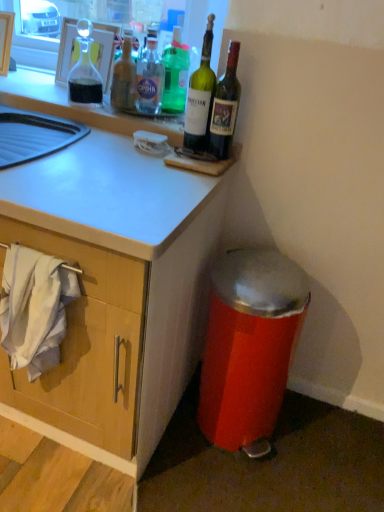
Question: Is translucent glass bottle at upper center, marked as the 1th bottle in a left-to-right arrangement, wider than green glass bottle at upper center, the 2th bottle positioned from the right?

Choices:
 (A) yes
 (B) no

Answer: (B)

Question: Is translucent glass bottle at upper center, acting as the fifth bottle starting from the right, next to green glass bottle at upper center, the 2th bottle positioned from the right, and touching it?

Choices:
 (A) no
 (B) yes

Answer: (A)

Question: Does translucent glass bottle at upper center, acting as the fifth bottle starting from the right, appear on the left side of green glass bottle at upper center, the 2th bottle positioned from the right?

Choices:
 (A) yes
 (B) no

Answer: (A)

Question: Is translucent glass bottle at upper center, acting as the fifth bottle starting from the right, facing away from green glass bottle at upper center, the 2th bottle positioned from the right?

Choices:
 (A) no
 (B) yes

Answer: (A)

Question: Is translucent glass bottle at upper center, marked as the 1th bottle in a left-to-right arrangement, further to camera compared to green glass bottle at upper center, the 2th bottle positioned from the right?

Choices:
 (A) no
 (B) yes

Answer: (B)

Question: From a real-world perspective, is translucent glass bottle at upper center, acting as the fifth bottle starting from the right, on top of green glass bottle at upper center, the 2th bottle positioned from the right?

Choices:
 (A) no
 (B) yes

Answer: (A)

Question: Is translucent glass bottle at upper center, marked as the 1th bottle in a left-to-right arrangement, touching metallic red trash can at lower right?

Choices:
 (A) yes
 (B) no

Answer: (B)

Question: Does translucent glass bottle at upper center, acting as the fifth bottle starting from the right, appear on the left side of metallic red trash can at lower right?

Choices:
 (A) no
 (B) yes

Answer: (B)

Question: Can you confirm if translucent glass bottle at upper center, marked as the 1th bottle in a left-to-right arrangement, is wider than metallic red trash can at lower right?

Choices:
 (A) yes
 (B) no

Answer: (B)

Question: Is translucent glass bottle at upper center, acting as the fifth bottle starting from the right, turned away from metallic red trash can at lower right?

Choices:
 (A) no
 (B) yes

Answer: (A)

Question: Is there a large distance between translucent glass bottle at upper center, marked as the 1th bottle in a left-to-right arrangement, and metallic red trash can at lower right?

Choices:
 (A) yes
 (B) no

Answer: (B)

Question: Considering the relative sizes of translucent glass bottle at upper center, acting as the fifth bottle starting from the right, and metallic red trash can at lower right in the image provided, is translucent glass bottle at upper center, acting as the fifth bottle starting from the right, taller than metallic red trash can at lower right?

Choices:
 (A) yes
 (B) no

Answer: (B)

Question: Is white fabric at lower left not inside green glass bottle at upper right, positioned as the 1th bottle in right-to-left order?

Choices:
 (A) yes
 (B) no

Answer: (A)